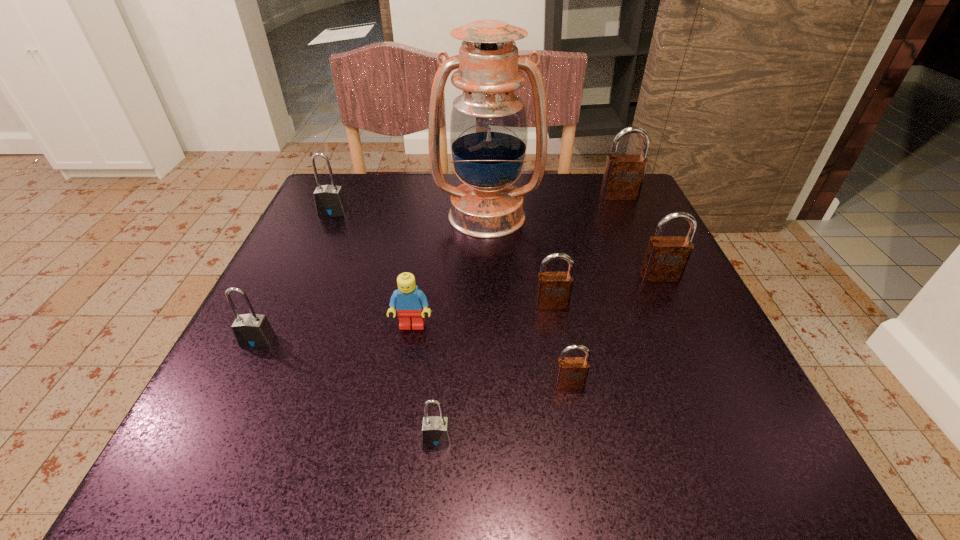
Identify the location of free point at the near edge. The width and height of the screenshot is (960, 540). [x=429, y=463].

Where is `vacant point at the left edge`? vacant point at the left edge is located at coordinates pyautogui.click(x=288, y=355).

In the image, there is a desktop. Where is `vacant space at the far right corner`? The height and width of the screenshot is (540, 960). vacant space at the far right corner is located at coordinates (595, 205).

Find the location of a particular element. Image resolution: width=960 pixels, height=540 pixels. vacant area at the near right corner is located at coordinates (673, 460).

The width and height of the screenshot is (960, 540). Identify the location of free space between the farthest gray padlock and the blue oil lamp. (410, 214).

The image size is (960, 540). Find the location of `free space between the smallest gray padlock and the sixth nearest object`. free space between the smallest gray padlock and the sixth nearest object is located at coordinates (548, 357).

In order to click on free space between the second nearest padlock and the tallest object in this screenshot , I will do `click(528, 300)`.

The height and width of the screenshot is (540, 960). What are the coordinates of `free point between the nearest padlock and the second biggest gray padlock` in the screenshot? It's located at (348, 389).

The height and width of the screenshot is (540, 960). In order to click on vacant area that lies between the second nearest gray padlock and the farthest gray padlock in this screenshot , I will do `click(295, 276)`.

Find the location of a particular element. This screenshot has width=960, height=540. vacant space that's between the second tallest object and the tallest object is located at coordinates (553, 206).